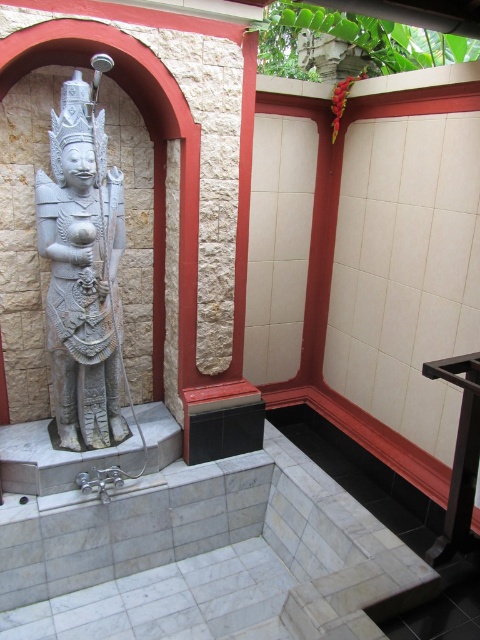
You are standing in the outdoor shower area and want to reach a soap dish located at point (93, 444) and a towel rack at point (451, 529). Which object is closer to you?

Point (93, 444) is further to the camera than point (451, 529). Therefore, the towel rack at point (451, 529) is closer to you.

You are a visitor at this outdoor shower area and want to place a small potted plant between the gray stone statue at left and the black plastic stool at lower right. Considering their heights, which object should the plant be placed closer to?

The gray stone statue at left is taller than the black plastic stool at lower right, so the plant should be placed closer to the black plastic stool at lower right to maintain visual balance.

You are standing in the outdoor shower area and need to locate the gray stone statue at left. According to the coordinates provided, where exactly is it positioned?

The gray stone statue at left is located at point (84, 268).